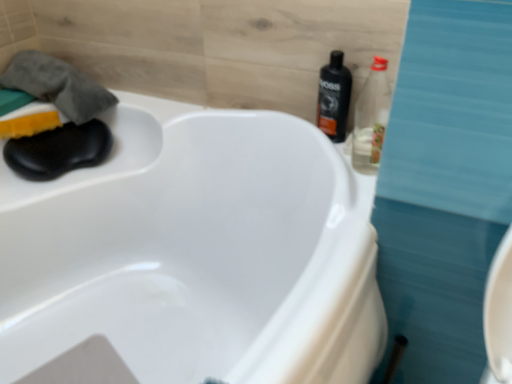
Question: From a real-world perspective, is gray cotton towel at upper left positioned above or below clear plastic bottle at upper right, placed as the second bottle when sorted from back to front?

Choices:
 (A) above
 (B) below

Answer: (B)

Question: In terms of height, does gray cotton towel at upper left look taller or shorter compared to clear plastic bottle at upper right, placed as the second bottle when sorted from back to front?

Choices:
 (A) short
 (B) tall

Answer: (A)

Question: Which is nearer to the gray cotton towel at upper left?

Choices:
 (A) black plastic bottle at upper right, the 1th bottle from the back
 (B) clear plastic bottle at upper right, placed as the second bottle when sorted from back to front
 (C) yellow sponge at left

Answer: (C)

Question: Based on their relative distances, which object is nearer to the clear plastic bottle at upper right, positioned as the 1th bottle in front-to-back order?

Choices:
 (A) gray cotton towel at upper left
 (B) black plastic bottle at upper right, placed as the 2th bottle when sorted from front to back
 (C) yellow sponge at left

Answer: (B)